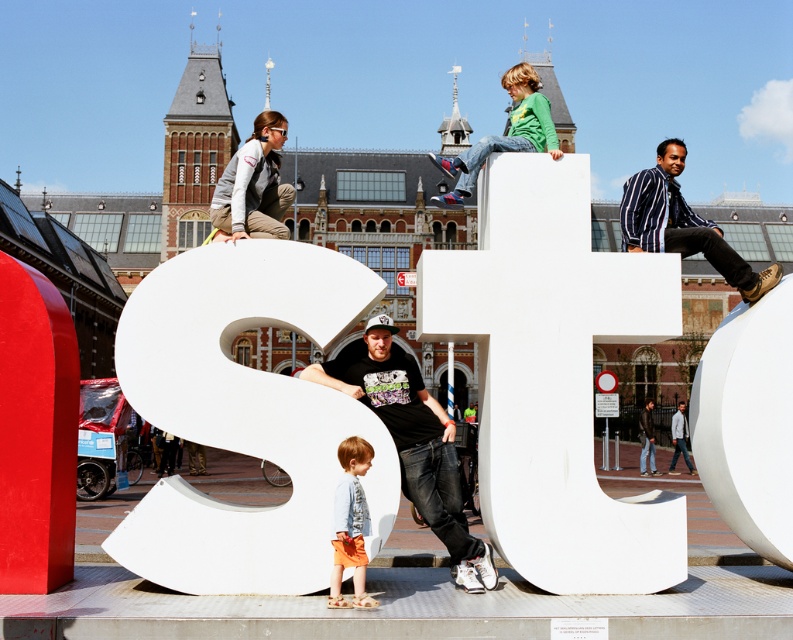
Question: Can you confirm if white matte letter s at center is positioned above black matte t-shirt at center?

Choices:
 (A) yes
 (B) no

Answer: (A)

Question: Which object is the closest to the white matte letter t at upper center?

Choices:
 (A) striped shirt at upper right
 (B) dark brown leather jacket at lower right

Answer: (A)

Question: Considering the relative positions of white matte letter s at center and striped shirt at upper right in the image provided, where is white matte letter s at center located with respect to striped shirt at upper right?

Choices:
 (A) right
 (B) left

Answer: (B)

Question: Which is farther from the striped shirt at upper right?

Choices:
 (A) white matte sphere at right
 (B) light gray fabric jacket at upper left
 (C) denim jacket at lower center

Answer: (B)

Question: Which is nearer to the black matte t-shirt at center?

Choices:
 (A) green jersey at upper center
 (B) white matte sphere at right
 (C) light gray fabric jacket at upper left

Answer: (C)

Question: Is light gray fabric jacket at upper left to the right of dark brown leather jacket at lower right from the viewer's perspective?

Choices:
 (A) yes
 (B) no

Answer: (B)